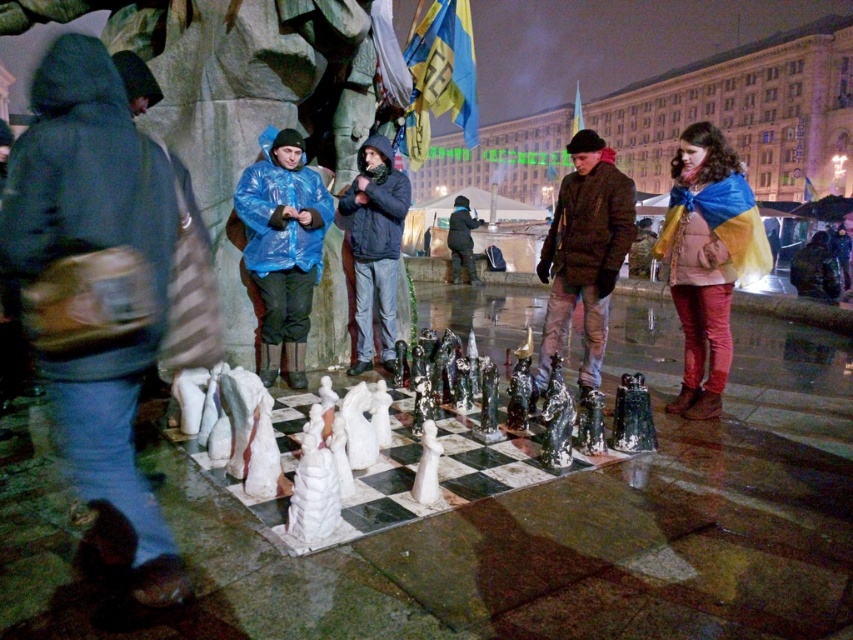
Consider the image. You are a photographer standing in the square and want to capture both the blue and yellow fabric draped at center and the matte blue raincoat at center in a single photo. Which object should you focus on first to ensure both are in frame?

The blue and yellow fabric draped at center is not as tall as matte blue raincoat at center, so you should focus on the taller matte blue raincoat at center first to ensure both are in frame.

You are standing at the center of the square and want to place a new decorative item exactly at point (373,454). What will you find there?

You will find the white marble chess set at center at point (373,454).